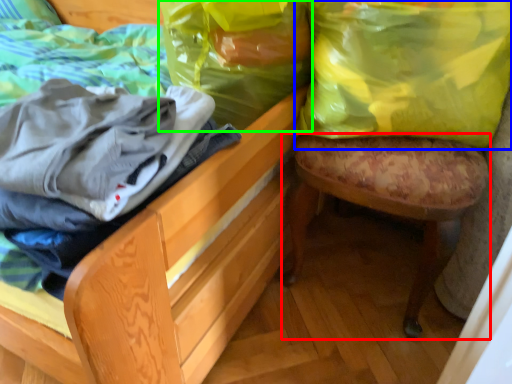
Question: Which object is positioned farthest from stool (highlighted by a red box)? Select from shopping bag (highlighted by a blue box) and shopping bag (highlighted by a green box).

Choices:
 (A) shopping bag
 (B) shopping bag

Answer: (B)